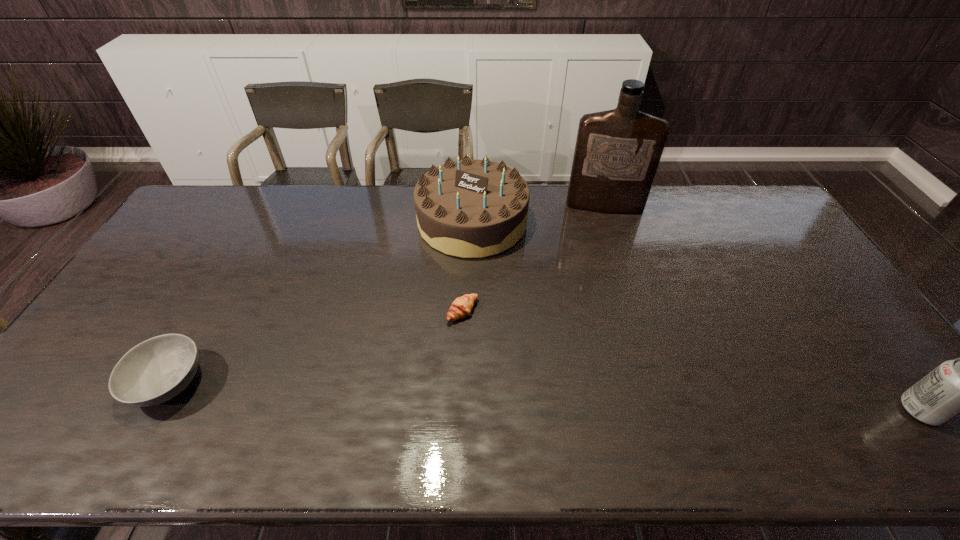
The width and height of the screenshot is (960, 540). Identify the location of vacant area that lies between the fourth tallest object and the birthday cake. (321, 302).

Where is `free space between the soda can and the liquor`? This screenshot has width=960, height=540. free space between the soda can and the liquor is located at coordinates (762, 308).

Locate an element on the screen. The width and height of the screenshot is (960, 540). vacant region between the tallest object and the leftmost object is located at coordinates (387, 294).

You are a GUI agent. You are given a task and a screenshot of the screen. Output one action in this format:
    pyautogui.click(x=<x>, y=<y>)
    Task: Click on the unoccupied position between the second object from right to left and the pastry
    
    Given the screenshot: What is the action you would take?
    pyautogui.click(x=534, y=259)

The image size is (960, 540). In order to click on unoccupied position between the liquor and the second shortest object in this screenshot , I will do `click(387, 294)`.

Where is `free spot between the rightmost object and the pastry`? This screenshot has height=540, width=960. free spot between the rightmost object and the pastry is located at coordinates (691, 361).

Locate an element on the screen. The image size is (960, 540). free point between the tallest object and the rightmost object is located at coordinates (762, 308).

This screenshot has width=960, height=540. In order to click on vacant area that lies between the fourth object from left to right and the soda can in this screenshot , I will do `click(762, 308)`.

This screenshot has height=540, width=960. In order to click on empty space between the fourth tallest object and the second tallest object in this screenshot , I will do `click(321, 302)`.

The height and width of the screenshot is (540, 960). What are the coordinates of `vacant space that is in between the tallest object and the third nearest object` in the screenshot? It's located at (534, 259).